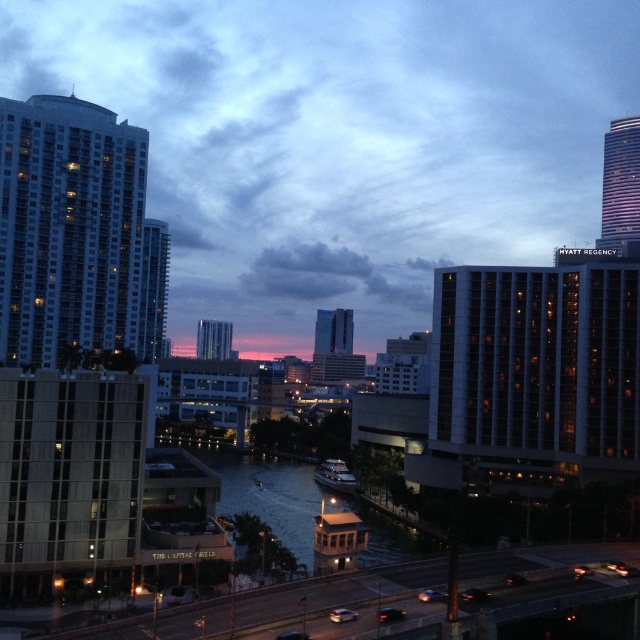
Based on the scene description, which object occupies a larger portion of the image between the matte glass building at left and the greenish water at center?

The matte glass building at left occupies a larger portion of the image than the greenish water at center.

You are a tourist standing on the riverbank and want to take a photo of the matte glass building at left and the greenish water at center. Which object should you frame first in your camera viewfinder to ensure both are in the shot?

You should frame the matte glass building at left first since it is positioned to the left of the greenish water at center, allowing both objects to be captured in the same frame.